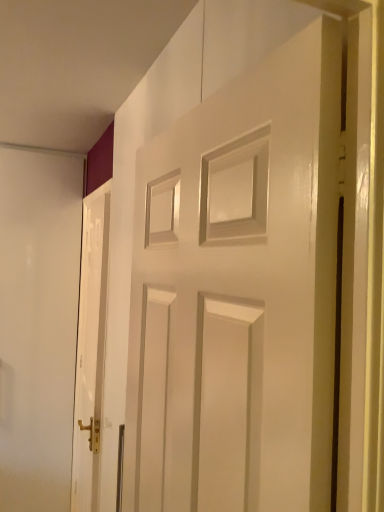
Question: Should I look upward or downward to see glossy white door at center, marked as the second door in a left-to-right arrangement?

Choices:
 (A) down
 (B) up

Answer: (A)

Question: Is glossy white door at center, the first door when ordered from front to back, outside white glossy door at left, which is the second door in right-to-left order?

Choices:
 (A) no
 (B) yes

Answer: (B)

Question: Is the position of glossy white door at center, the first door when ordered from front to back, less distant than that of white glossy door at left, which ranks as the 2th door in front-to-back order?

Choices:
 (A) no
 (B) yes

Answer: (B)

Question: Considering the relative sizes of glossy white door at center, the first door when ordered from front to back, and white glossy door at left, arranged as the first door when viewed from the back, in the image provided, is glossy white door at center, the first door when ordered from front to back, thinner than white glossy door at left, arranged as the first door when viewed from the back,?

Choices:
 (A) no
 (B) yes

Answer: (A)

Question: Is white glossy door at left, which is counted as the first door, starting from the left, surrounded by glossy white door at center, which is counted as the second door, starting from the back?

Choices:
 (A) no
 (B) yes

Answer: (A)

Question: Is glossy white door at center, marked as the second door in a left-to-right arrangement, smaller than white glossy door at left, which ranks as the 2th door in front-to-back order?

Choices:
 (A) yes
 (B) no

Answer: (B)

Question: From a real-world perspective, is glossy white door at center, the first door when ordered from front to back, positioned under white glossy door at left, which is the second door in right-to-left order, based on gravity?

Choices:
 (A) no
 (B) yes

Answer: (A)

Question: Can you confirm if white glossy door at left, arranged as the first door when viewed from the back, is positioned to the left of glossy white door at center, which is counted as the second door, starting from the back?

Choices:
 (A) yes
 (B) no

Answer: (A)

Question: Considering the relative sizes of white glossy door at left, which ranks as the 2th door in front-to-back order, and glossy white door at center, the first door when ordered from front to back, in the image provided, is white glossy door at left, which ranks as the 2th door in front-to-back order, smaller than glossy white door at center, the first door when ordered from front to back,?

Choices:
 (A) yes
 (B) no

Answer: (A)

Question: Is white glossy door at left, which is the second door in right-to-left order, turned away from glossy white door at center, marked as the second door in a left-to-right arrangement?

Choices:
 (A) yes
 (B) no

Answer: (B)

Question: Is white glossy door at left, which is the second door in right-to-left order, completely or partially outside of glossy white door at center, marked as the second door in a left-to-right arrangement?

Choices:
 (A) yes
 (B) no

Answer: (A)

Question: Is glossy white door at center, marked as the second door in a left-to-right arrangement, completely or partially inside white glossy door at left, which ranks as the 2th door in front-to-back order?

Choices:
 (A) no
 (B) yes

Answer: (A)

Question: Considering the relative sizes of white glossy door at left, which is counted as the first door, starting from the left, and glossy white door at center, the first door when ordered from front to back, in the image provided, is white glossy door at left, which is counted as the first door, starting from the left, wider than glossy white door at center, the first door when ordered from front to back,?

Choices:
 (A) no
 (B) yes

Answer: (A)

Question: From a real-world perspective, is glossy white door at center, the first door when ordered from front to back, above or below white glossy door at left, arranged as the first door when viewed from the back?

Choices:
 (A) above
 (B) below

Answer: (A)